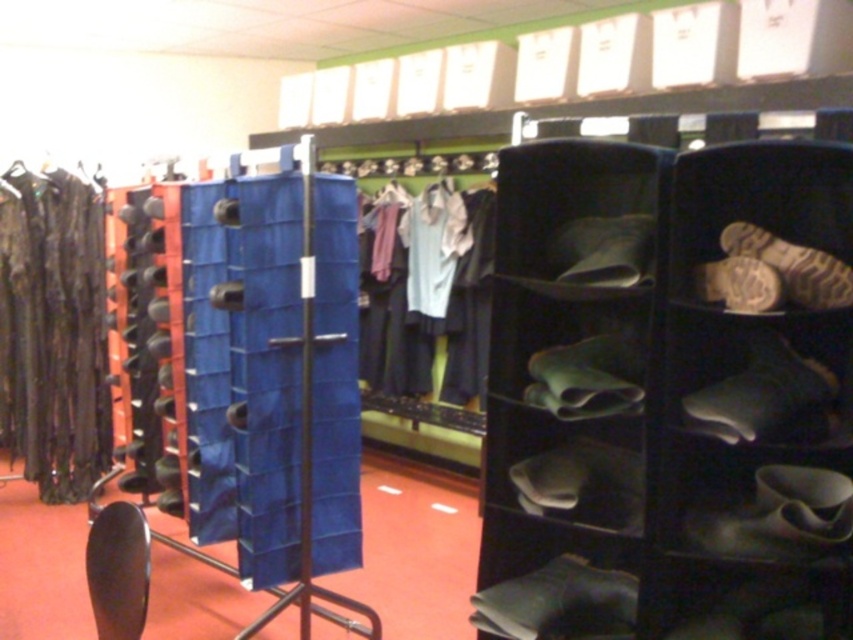
Is the position of black fabric shoe rack at right less distant than that of shiny black dress at left?

That is True.

In the scene shown: Does black fabric shoe rack at right appear on the left side of shiny black dress at left?

Incorrect, black fabric shoe rack at right is not on the left side of shiny black dress at left.

Who is more distant from viewer, (762, 356) or (48, 262)?

The point (48, 262) is behind.

The width and height of the screenshot is (853, 640). I want to click on black fabric shoe rack at right, so click(668, 396).

Who is more distant from viewer, [28,435] or [410,228]?

Point [410,228]

Does shiny black dress at left have a lesser width compared to light blue fabric shirt at center?

Yes.

Is point (80, 256) less distant than point (433, 253)?

Yes, point (80, 256) is closer to viewer.

Locate an element on the screen. This screenshot has height=640, width=853. shiny black dress at left is located at coordinates click(53, 332).

Is black fabric shoe rack at right further to camera compared to light blue fabric shirt at center?

No, it is not.

Can you confirm if black fabric shoe rack at right is thinner than light blue fabric shirt at center?

In fact, black fabric shoe rack at right might be wider than light blue fabric shirt at center.

Image resolution: width=853 pixels, height=640 pixels. Describe the element at coordinates (668, 396) in the screenshot. I see `black fabric shoe rack at right` at that location.

The image size is (853, 640). I want to click on black fabric shoe rack at right, so click(668, 396).